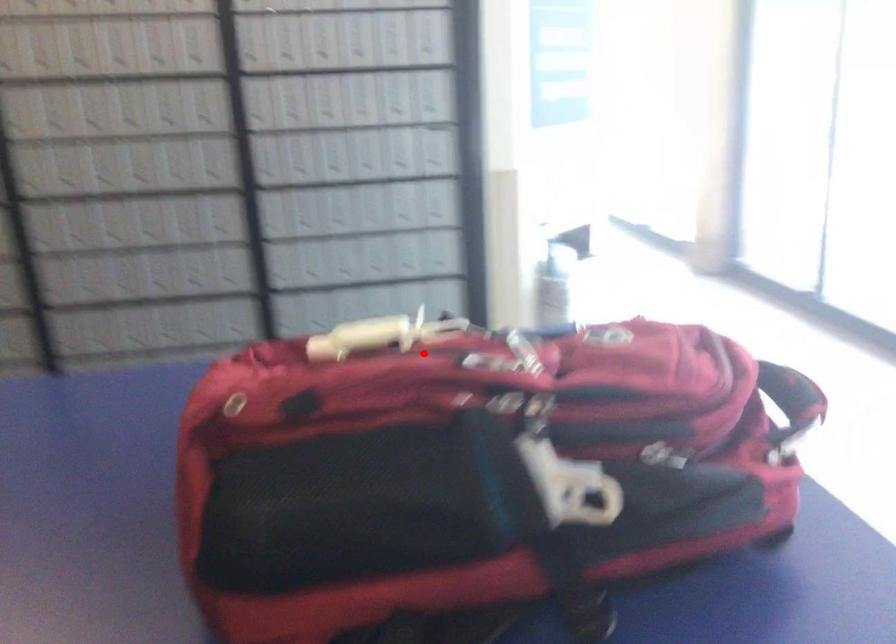
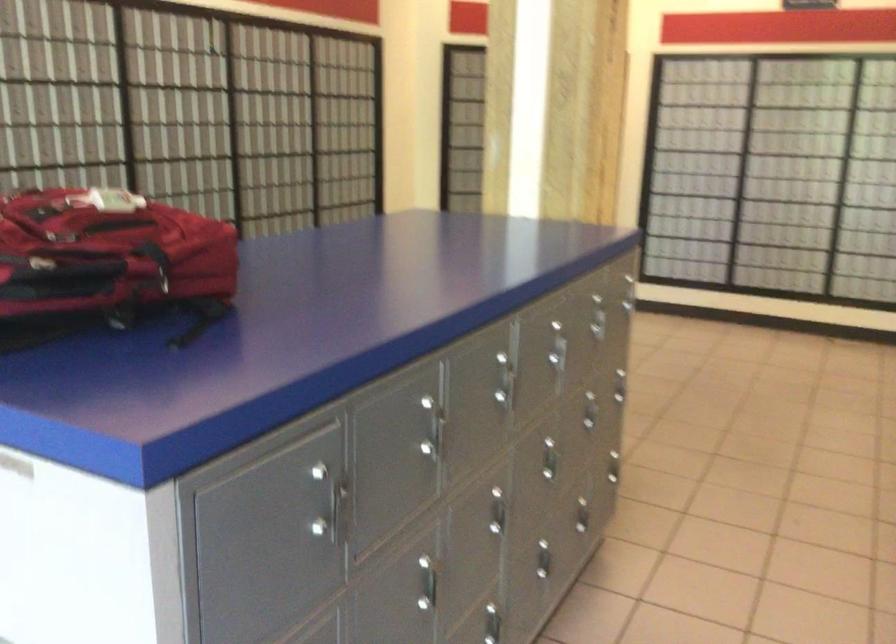
Question: I am providing you with two images of the same scene from different viewpoints. Given a red point in image1, look at the same physical point in image2. Is it:

Choices:
 (A) Closer to the viewpoint
 (B) Farther from the viewpoint

Answer: (B)